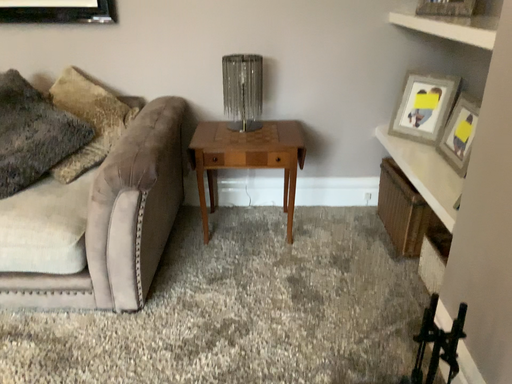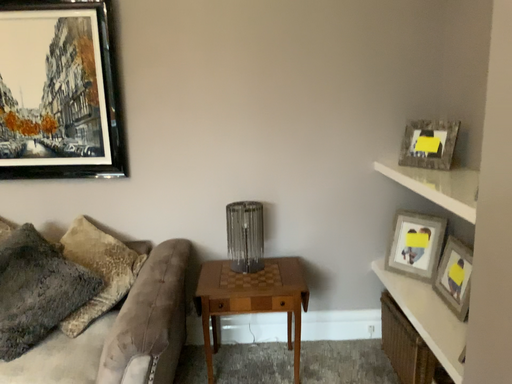
Question: Which way did the camera rotate in the video?

Choices:
 (A) rotated upward
 (B) rotated downward

Answer: (A)